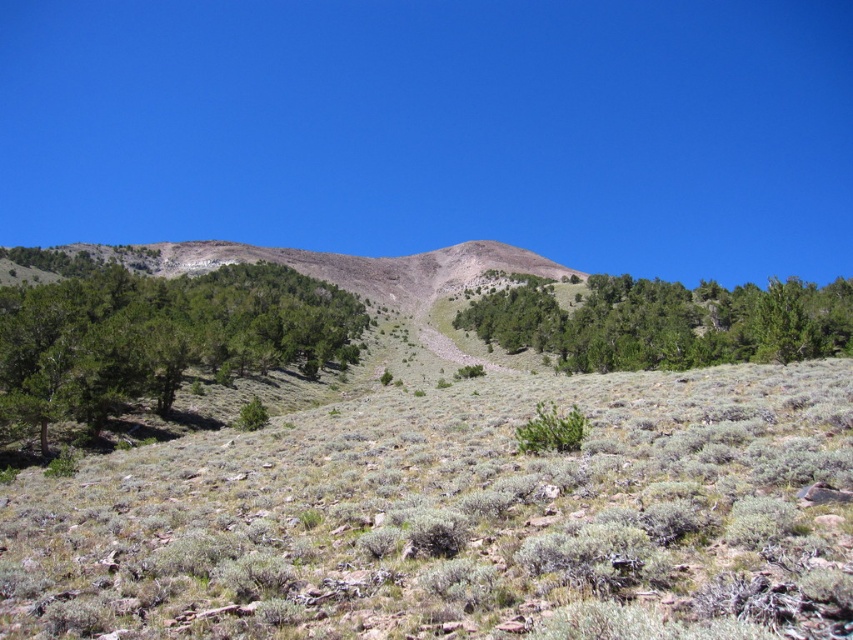
Question: Does green leafy tree at center-left lie in front of green leafy trees at center?

Choices:
 (A) no
 (B) yes

Answer: (B)

Question: Which point appears closest to the camera in this image?

Choices:
 (A) (306, 305)
 (B) (846, 353)

Answer: (B)

Question: Does green leafy tree at center-left appear over green leafy trees at center?

Choices:
 (A) yes
 (B) no

Answer: (A)

Question: Among these points, which one is nearest to the camera?

Choices:
 (A) (122, 376)
 (B) (657, 298)

Answer: (A)

Question: Is green leafy tree at center-left below green leafy trees at center?

Choices:
 (A) no
 (B) yes

Answer: (A)